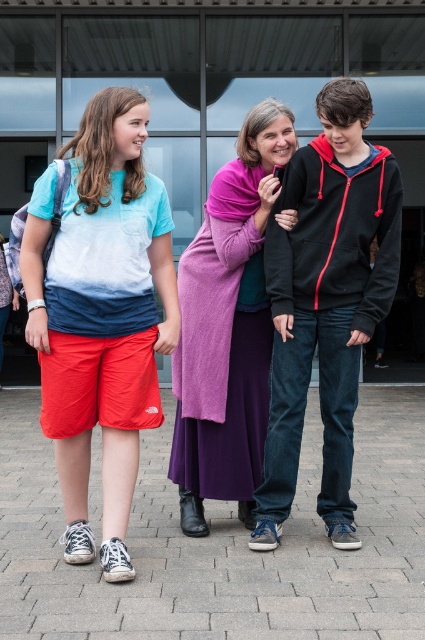
Question: Which point is closer to the camera?

Choices:
 (A) (288, 509)
 (B) (184, 419)

Answer: (A)

Question: Considering the real-world distances, which object is farthest from the brick pavement at center?

Choices:
 (A) black zip-up hoodie at center
 (B) dyed cotton shorts at left

Answer: (A)

Question: Which point appears farthest from the camera in this image?

Choices:
 (A) (85, 314)
 (B) (175, 477)
 (C) (331, 410)

Answer: (B)

Question: Is dyed cotton shorts at left positioned in front of purple knit sweater at center?

Choices:
 (A) no
 (B) yes

Answer: (B)

Question: Can you confirm if brick pavement at center is bigger than dyed cotton shorts at left?

Choices:
 (A) yes
 (B) no

Answer: (A)

Question: Can you confirm if dyed cotton shorts at left is positioned to the left of purple knit sweater at center?

Choices:
 (A) no
 (B) yes

Answer: (B)